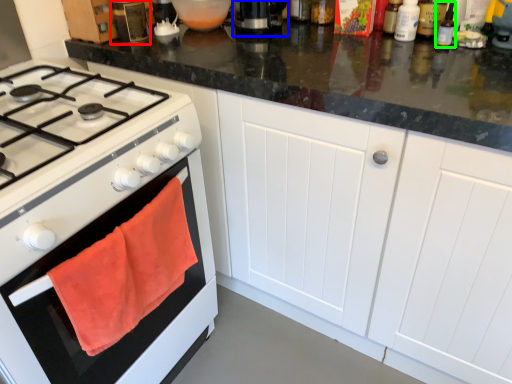
Question: Which is nearer to the kitchen appliance (highlighted by a red box)? coffee machine (highlighted by a blue box) or bottle (highlighted by a green box).

Choices:
 (A) coffee machine
 (B) bottle

Answer: (A)